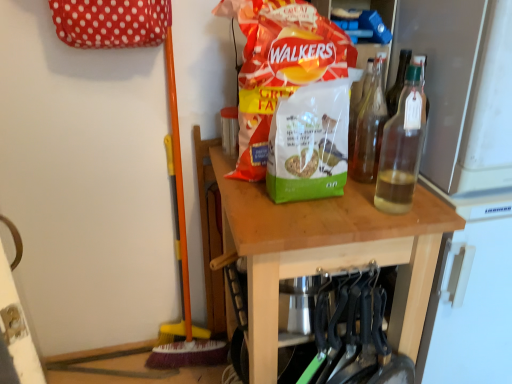
The width and height of the screenshot is (512, 384). In order to click on free space in front of matte plastic bag of walkers crisps at center, arranged as the first waste when viewed from the top in this screenshot , I will do `click(300, 217)`.